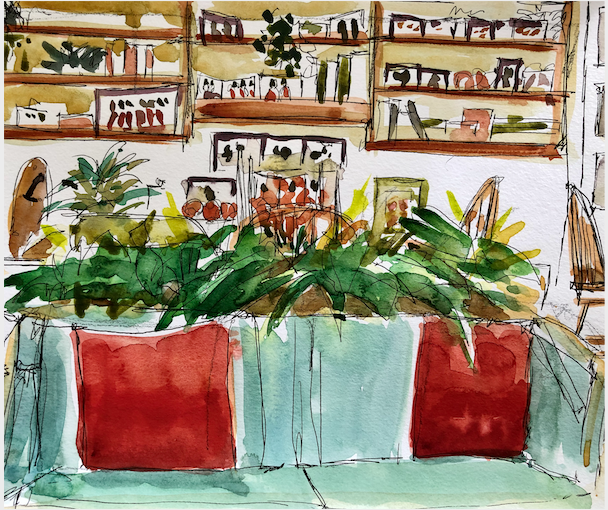
Find the location of `1 partial brown chair`. 1 partial brown chair is located at coordinates (584, 262).